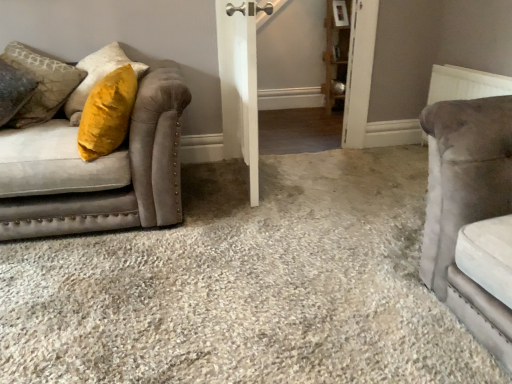
Question: Can you confirm if velvet gray couch at left is positioned to the left of wooden shelf at upper right?

Choices:
 (A) no
 (B) yes

Answer: (B)

Question: Is velvet gray couch at left facing away from wooden shelf at upper right?

Choices:
 (A) no
 (B) yes

Answer: (A)

Question: Would you say velvet gray couch at left is outside wooden shelf at upper right?

Choices:
 (A) no
 (B) yes

Answer: (B)

Question: Can you confirm if velvet gray couch at left is thinner than wooden shelf at upper right?

Choices:
 (A) no
 (B) yes

Answer: (A)

Question: From a real-world perspective, is velvet gray couch at left positioned over wooden shelf at upper right based on gravity?

Choices:
 (A) yes
 (B) no

Answer: (B)

Question: From a real-world perspective, does velvet gray couch at left sit lower than wooden shelf at upper right?

Choices:
 (A) yes
 (B) no

Answer: (A)

Question: Can you confirm if white textured radiator at upper right is smaller than wooden shelf at upper right?

Choices:
 (A) no
 (B) yes

Answer: (B)

Question: From the image's perspective, is white textured radiator at upper right below wooden shelf at upper right?

Choices:
 (A) yes
 (B) no

Answer: (A)

Question: Is white textured radiator at upper right oriented towards wooden shelf at upper right?

Choices:
 (A) no
 (B) yes

Answer: (A)

Question: Is white textured radiator at upper right positioned beyond the bounds of wooden shelf at upper right?

Choices:
 (A) yes
 (B) no

Answer: (A)

Question: Considering the relative positions of white textured radiator at upper right and wooden shelf at upper right in the image provided, is white textured radiator at upper right behind wooden shelf at upper right?

Choices:
 (A) yes
 (B) no

Answer: (B)

Question: Considering the relative sizes of white textured radiator at upper right and wooden shelf at upper right in the image provided, is white textured radiator at upper right taller than wooden shelf at upper right?

Choices:
 (A) no
 (B) yes

Answer: (A)

Question: Does white textured radiator at upper right come behind white wooden barn door at center?

Choices:
 (A) yes
 (B) no

Answer: (A)